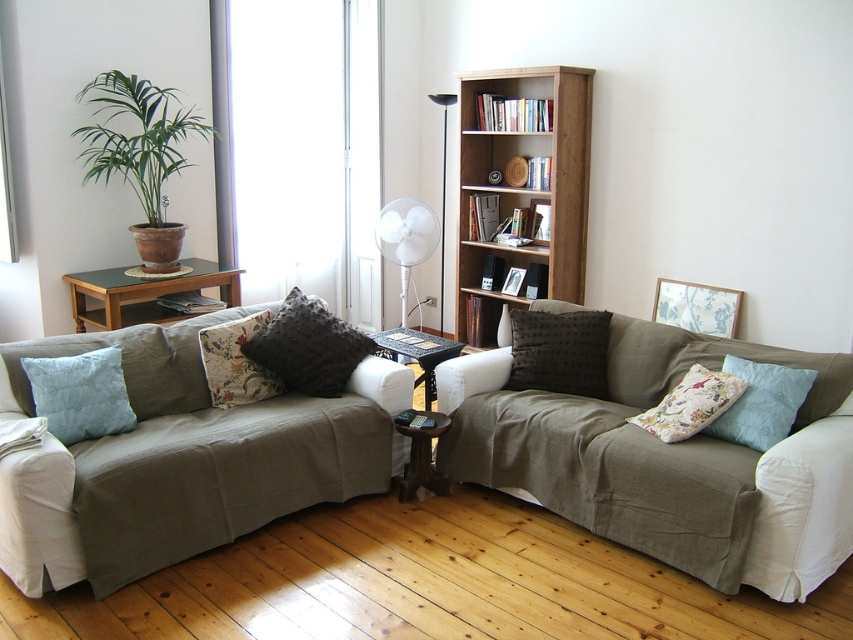
You are sitting on the sofa and want to reach both the textured dark gray pillow at center and the brown wooden side table at center. Which object is closer to you?

The textured dark gray pillow at center is closer to you because it is further to the viewer than the brown wooden side table at center.

You are standing in the living room and want to reach a point that is 3.67 meters away from you. Is the point at coordinates point (332,372) within your reach?

The distance of point (332,372) from viewer is 3.67 meters, so if you are standing in the living room, the point at coordinates point (332,372) is 3.67 meters away from you. Whether you can reach it depends on your ability to move that distance.

You are sitting on the sofa and want to place your phone on the nearest surface. Which object between the textured dark gray pillow at center and the brown wooden side table at center is closer to you?

The brown wooden side table at center is closer to you since it is at center, while the textured dark gray pillow at center is also at center but the side table is a surface you can place your phone on.